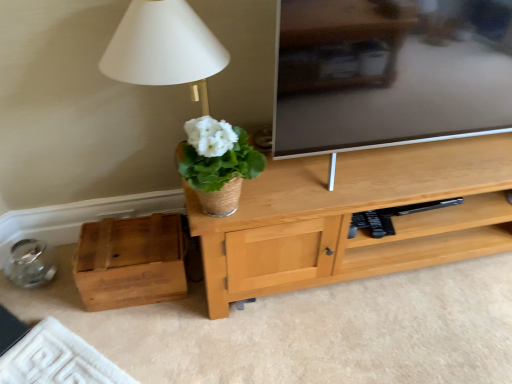
This screenshot has width=512, height=384. Describe the element at coordinates (218, 163) in the screenshot. I see `white woven pot at center` at that location.

Identify the location of white woven pot at center. (218, 163).

The width and height of the screenshot is (512, 384). I want to click on wooden box at lower left, so click(x=130, y=262).

Describe the element at coordinates (130, 262) in the screenshot. I see `wooden box at lower left` at that location.

This screenshot has width=512, height=384. I want to click on white woven pot at center, so [x=218, y=163].

Which object is positioned more to the right, wooden box at lower left or white woven pot at center?

From the viewer's perspective, white woven pot at center appears more on the right side.

Is wooden box at lower left closer to the viewer compared to white woven pot at center?

No, it is behind white woven pot at center.

Which is in front, point (133, 234) or point (200, 119)?

The point (200, 119) is more forward.

From the image's perspective, between wooden box at lower left and white woven pot at center, which one is located above?

white woven pot at center, from the image's perspective.

From a real-world perspective, does wooden box at lower left sit lower than white woven pot at center?

Yes, from a real-world perspective, wooden box at lower left is under white woven pot at center.

Can you confirm if wooden box at lower left is thinner than white woven pot at center?

In fact, wooden box at lower left might be wider than white woven pot at center.

Who is shorter, wooden box at lower left or white woven pot at center?

wooden box at lower left.

Which of these two, wooden box at lower left or white woven pot at center, is smaller?

white woven pot at center.

Is wooden box at lower left outside of white woven pot at center?

Yes, wooden box at lower left is located beyond the bounds of white woven pot at center.

Is wooden box at lower left next to white woven pot at center?

No, wooden box at lower left is not next to white woven pot at center.

Is wooden box at lower left oriented away from white woven pot at center?

No.

How different are the orientations of wooden box at lower left and white woven pot at center in degrees?

The angle between the facing direction of wooden box at lower left and the facing direction of white woven pot at center is 2.95 degrees.

I want to click on box lying behind the white woven pot at center, so click(130, 262).

Which object is positioned more to the right, white woven pot at center or wooden box at lower left?

white woven pot at center.

Considering the positions of objects white woven pot at center and wooden box at lower left in the image provided, who is behind, white woven pot at center or wooden box at lower left?

wooden box at lower left is further from the camera.

Considering the points (232, 174) and (91, 245), which point is behind, point (232, 174) or point (91, 245)?

The point (91, 245) is behind.

From the image's perspective, which object appears higher, white woven pot at center or wooden box at lower left?

white woven pot at center is shown above in the image.

From a real-world perspective, is white woven pot at center beneath wooden box at lower left?

Incorrect, from a real-world perspective, white woven pot at center is higher than wooden box at lower left.

Considering the sizes of white woven pot at center and wooden box at lower left in the image, is white woven pot at center wider or thinner than wooden box at lower left?

Clearly, white woven pot at center has less width compared to wooden box at lower left.

Between white woven pot at center and wooden box at lower left, which one has less height?

wooden box at lower left is shorter.

Considering the sizes of objects white woven pot at center and wooden box at lower left in the image provided, who is smaller, white woven pot at center or wooden box at lower left?

Smaller between the two is white woven pot at center.

Is white woven pot at center surrounding wooden box at lower left?

Definitely not — wooden box at lower left is not inside white woven pot at center.

Can you see white woven pot at center touching wooden box at lower left?

white woven pot at center and wooden box at lower left are not in contact.

Is wooden box at lower left at the back of white woven pot at center?

No.

How many degrees apart are the facing directions of white woven pot at center and wooden box at lower left?

white woven pot at center and wooden box at lower left are facing 2.95 degrees away from each other.

Identify the location of houseplant located in front of the wooden box at lower left. (218, 163).

Identify the location of box on the left of white woven pot at center. The height and width of the screenshot is (384, 512). (130, 262).

This screenshot has height=384, width=512. Find the location of `box behind the white woven pot at center`. box behind the white woven pot at center is located at coordinates (130, 262).